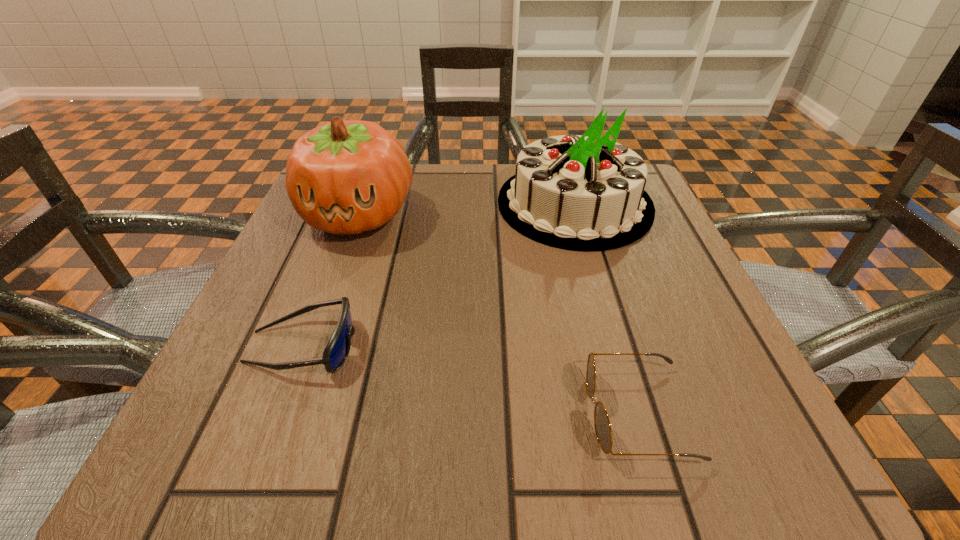
Find the location of a particular element. birthday cake is located at coordinates (585, 193).

Image resolution: width=960 pixels, height=540 pixels. In order to click on pumpkin in this screenshot , I will do `click(345, 177)`.

Where is `the left sunglasses`? The width and height of the screenshot is (960, 540). the left sunglasses is located at coordinates (337, 350).

Locate an element on the screen. the right sunglasses is located at coordinates (603, 430).

Identify the location of free space located on the front of the birthday cake. The height and width of the screenshot is (540, 960). pos(638,423).

The image size is (960, 540). Identify the location of vacant position located 0.200m on the side of the pumpkin with the cute face. (317, 331).

The image size is (960, 540). Identify the location of vacant space located 0.180m on the front-facing side of the left sunglasses. (477, 347).

Where is `free space located 0.360m on the lenses of the right sunglasses`? The width and height of the screenshot is (960, 540). free space located 0.360m on the lenses of the right sunglasses is located at coordinates (312, 413).

You are a GUI agent. You are given a task and a screenshot of the screen. Output one action in this format:
    pyautogui.click(x=<x>, y=<y>)
    Task: Click on the blank space located on the lenses of the right sunglasses
    This screenshot has height=540, width=960.
    Given the screenshot: What is the action you would take?
    pyautogui.click(x=512, y=413)

This screenshot has width=960, height=540. I want to click on free space located 0.290m on the lenses of the right sunglasses, so click(x=366, y=413).